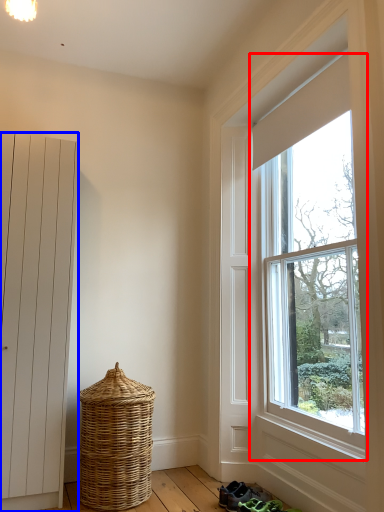
Question: Which object is further to the camera taking this photo, window (highlighted by a red box) or door (highlighted by a blue box)?

Choices:
 (A) window
 (B) door

Answer: (B)